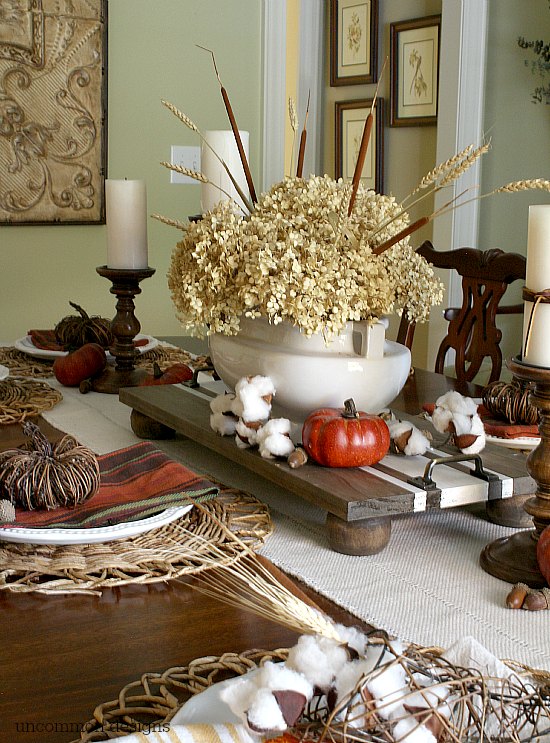
You are a GUI agent. You are given a task and a screenshot of the screen. Output one action in this format:
    pyautogui.click(x=<x>, y=<y>)
    Task: Click on the white vase
    
    Given the screenshot: What is the action you would take?
    pyautogui.click(x=337, y=371)